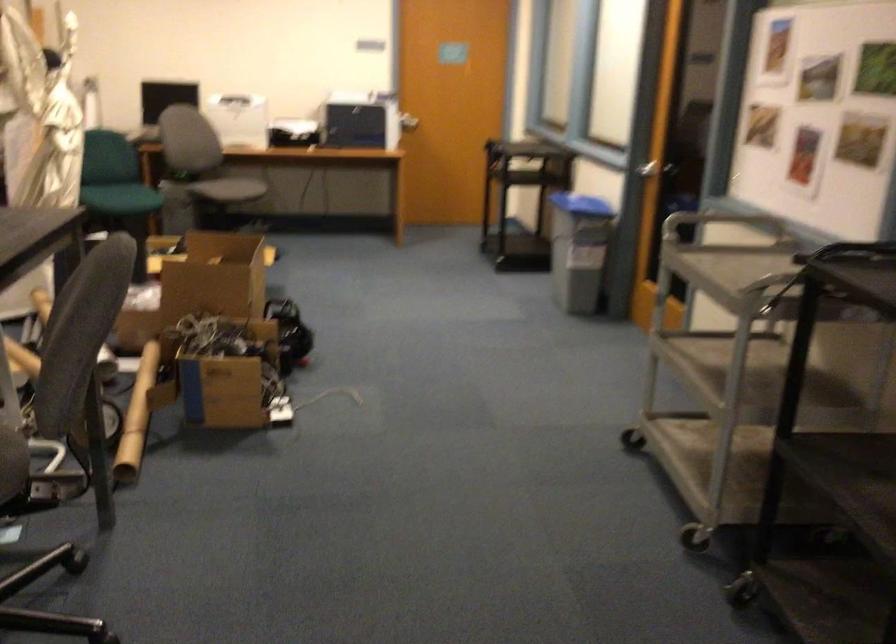
Locate an element on the screen. silver cart handle is located at coordinates point(748,225).